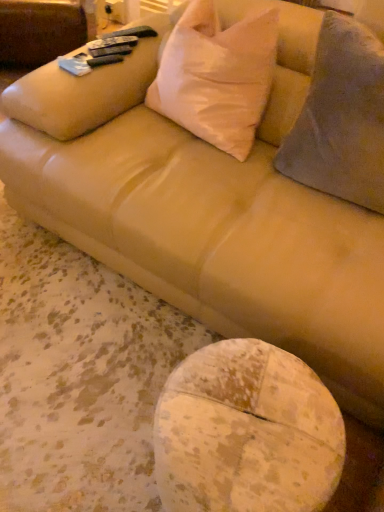
This screenshot has width=384, height=512. What do you see at coordinates (216, 76) in the screenshot?
I see `white matte pillow at upper center, the 2th throw pillow in the right-to-left sequence` at bounding box center [216, 76].

Image resolution: width=384 pixels, height=512 pixels. I want to click on speckled wood table at lower center, so click(x=246, y=433).

Locate an element on the screen. The width and height of the screenshot is (384, 512). white matte pillow at upper center, the first throw pillow from the left is located at coordinates (216, 76).

In the scene shown: From a real-world perspective, is speckled wood table at lower center physically located above or below white matte pillow at upper center, the first throw pillow from the left?

In terms of real-world spatial position, speckled wood table at lower center is below white matte pillow at upper center, the first throw pillow from the left.

Considering their positions, is speckled wood table at lower center located in front of or behind white matte pillow at upper center, the 2th throw pillow in the right-to-left sequence?

Visually, speckled wood table at lower center is located in front of white matte pillow at upper center, the 2th throw pillow in the right-to-left sequence.

At what (x,y) coordinates should I click in order to perform the action: click on throw pillow located on the left of speckled wood table at lower center. Please return your answer as a coordinate pair (x, y). Looking at the image, I should click on (216, 76).

Considering the relative sizes of gray fuzzy throw pillow at right, positioned as the first throw pillow in right-to-left order, and speckled wood table at lower center in the image provided, is gray fuzzy throw pillow at right, positioned as the first throw pillow in right-to-left order, thinner than speckled wood table at lower center?

No.

This screenshot has height=512, width=384. What are the coordinates of `throw pillow to the right of speckled wood table at lower center` in the screenshot? It's located at (341, 118).

Is gray fuzzy throw pillow at right, acting as the second throw pillow starting from the left, not within speckled wood table at lower center?

Yes, gray fuzzy throw pillow at right, acting as the second throw pillow starting from the left, is located beyond the bounds of speckled wood table at lower center.

Is gray fuzzy throw pillow at right, positioned as the first throw pillow in right-to-left order, facing away from speckled wood table at lower center?

gray fuzzy throw pillow at right, positioned as the first throw pillow in right-to-left order, is not turned away from speckled wood table at lower center.

From a real-world perspective, relative to speckled wood table at lower center, is white matte pillow at upper center, the 2th throw pillow in the right-to-left sequence, vertically above or below?

white matte pillow at upper center, the 2th throw pillow in the right-to-left sequence, is above speckled wood table at lower center.

Is white matte pillow at upper center, the 2th throw pillow in the right-to-left sequence, at the right side of speckled wood table at lower center?

No, white matte pillow at upper center, the 2th throw pillow in the right-to-left sequence, is not to the right of speckled wood table at lower center.

Is white matte pillow at upper center, the first throw pillow from the left, in front of or behind speckled wood table at lower center in the image?

white matte pillow at upper center, the first throw pillow from the left, is positioned farther from the viewer than speckled wood table at lower center.

From the image's perspective, is gray fuzzy throw pillow at right, acting as the second throw pillow starting from the left, above white matte pillow at upper center, the 2th throw pillow in the right-to-left sequence?

No.

Could you tell me if gray fuzzy throw pillow at right, positioned as the first throw pillow in right-to-left order, is turned towards white matte pillow at upper center, the 2th throw pillow in the right-to-left sequence?

No.

Identify the location of throw pillow in front of the white matte pillow at upper center, the 2th throw pillow in the right-to-left sequence. (341, 118).

Between gray fuzzy throw pillow at right, positioned as the first throw pillow in right-to-left order, and white matte pillow at upper center, the 2th throw pillow in the right-to-left sequence, which one has more height?

gray fuzzy throw pillow at right, positioned as the first throw pillow in right-to-left order, is taller.

Does white matte pillow at upper center, the first throw pillow from the left, have a smaller size compared to gray fuzzy throw pillow at right, acting as the second throw pillow starting from the left?

Yes, white matte pillow at upper center, the first throw pillow from the left, is smaller than gray fuzzy throw pillow at right, acting as the second throw pillow starting from the left.

Locate an element on the screen. throw pillow behind the gray fuzzy throw pillow at right, acting as the second throw pillow starting from the left is located at coordinates (216, 76).

At what (x,y) coordinates should I click in order to perform the action: click on round table below the gray fuzzy throw pillow at right, acting as the second throw pillow starting from the left (from a real-world perspective). Please return your answer as a coordinate pair (x, y). The width and height of the screenshot is (384, 512). Looking at the image, I should click on (246, 433).

Which object is thinner, speckled wood table at lower center or gray fuzzy throw pillow at right, acting as the second throw pillow starting from the left?

With smaller width is speckled wood table at lower center.

Consider the image. Measure the distance from speckled wood table at lower center to gray fuzzy throw pillow at right, positioned as the first throw pillow in right-to-left order.

speckled wood table at lower center and gray fuzzy throw pillow at right, positioned as the first throw pillow in right-to-left order, are 28.73 inches apart.

Is the depth of speckled wood table at lower center greater than that of gray fuzzy throw pillow at right, acting as the second throw pillow starting from the left?

No.

Find the location of `throw pillow on the left of speckled wood table at lower center`. throw pillow on the left of speckled wood table at lower center is located at coordinates (216, 76).

Identify the location of throw pillow that appears on the right of speckled wood table at lower center. This screenshot has width=384, height=512. (341, 118).

Looking at this image, when comparing their distances from gray fuzzy throw pillow at right, positioned as the first throw pillow in right-to-left order, does speckled wood table at lower center or white matte pillow at upper center, the 2th throw pillow in the right-to-left sequence, seem closer?

Based on the image, white matte pillow at upper center, the 2th throw pillow in the right-to-left sequence, appears to be nearer to gray fuzzy throw pillow at right, positioned as the first throw pillow in right-to-left order.

When comparing their distances from speckled wood table at lower center, does gray fuzzy throw pillow at right, acting as the second throw pillow starting from the left, or white matte pillow at upper center, the first throw pillow from the left, seem closer?

gray fuzzy throw pillow at right, acting as the second throw pillow starting from the left, lies closer to speckled wood table at lower center than the other object.

From the image, which object appears to be farther from white matte pillow at upper center, the 2th throw pillow in the right-to-left sequence, gray fuzzy throw pillow at right, positioned as the first throw pillow in right-to-left order, or speckled wood table at lower center?

speckled wood table at lower center is positioned further to the anchor white matte pillow at upper center, the 2th throw pillow in the right-to-left sequence.

When comparing their distances from gray fuzzy throw pillow at right, acting as the second throw pillow starting from the left, does white matte pillow at upper center, the first throw pillow from the left, or speckled wood table at lower center seem further?

The object further to gray fuzzy throw pillow at right, acting as the second throw pillow starting from the left, is speckled wood table at lower center.

Looking at the image, which one is located further to white matte pillow at upper center, the 2th throw pillow in the right-to-left sequence, speckled wood table at lower center or gray fuzzy throw pillow at right, acting as the second throw pillow starting from the left?

Among the two, speckled wood table at lower center is located further to white matte pillow at upper center, the 2th throw pillow in the right-to-left sequence.

Estimate the real-world distances between objects in this image. Which object is further from speckled wood table at lower center, white matte pillow at upper center, the 2th throw pillow in the right-to-left sequence, or gray fuzzy throw pillow at right, acting as the second throw pillow starting from the left?

Based on the image, white matte pillow at upper center, the 2th throw pillow in the right-to-left sequence, appears to be further to speckled wood table at lower center.

Find the location of a particular element. throw pillow between white matte pillow at upper center, the 2th throw pillow in the right-to-left sequence, and speckled wood table at lower center, in the vertical direction is located at coordinates (341, 118).